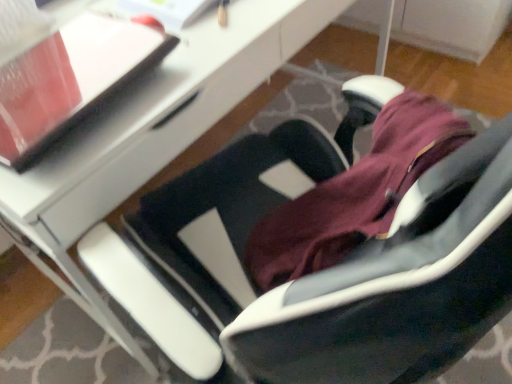
Describe the element at coordinates (71, 79) in the screenshot. I see `matte black notepad at upper left` at that location.

Where is `matte black notepad at upper left`? The width and height of the screenshot is (512, 384). matte black notepad at upper left is located at coordinates (71, 79).

You are a GUI agent. You are given a task and a screenshot of the screen. Output one action in this format:
    pyautogui.click(x=<x>, y=<y>)
    Task: Click on the white glossy desk at center
    This screenshot has height=384, width=512.
    Given the screenshot: What is the action you would take?
    pyautogui.click(x=160, y=118)

What is the approximate height of white glossy desk at center?

white glossy desk at center is 31.30 inches in height.

Measure the distance between point (205,107) and camera.

Point (205,107) is 34.25 inches from camera.

What do you see at coordinates (160, 118) in the screenshot? The width and height of the screenshot is (512, 384). I see `white glossy desk at center` at bounding box center [160, 118].

Locate an element on the screen. matte black notepad at upper left is located at coordinates (71, 79).

Which object is positioned more to the right, matte black notepad at upper left or white glossy desk at center?

white glossy desk at center.

Is matte black notepad at upper left closer to camera compared to white glossy desk at center?

Yes, it is.

Is point (134, 28) less distant than point (263, 41)?

Yes.

From the image's perspective, between matte black notepad at upper left and white glossy desk at center, who is located below?

From the image's view, matte black notepad at upper left is below.

From a real-world perspective, is matte black notepad at upper left under white glossy desk at center?

No.

Does matte black notepad at upper left have a lesser width compared to white glossy desk at center?

Yes.

Can you confirm if matte black notepad at upper left is shorter than white glossy desk at center?

Yes, matte black notepad at upper left is shorter than white glossy desk at center.

Based on their sizes in the image, would you say matte black notepad at upper left is bigger or smaller than white glossy desk at center?

In the image, matte black notepad at upper left appears to be smaller than white glossy desk at center.

Consider the image. Which is correct: matte black notepad at upper left is inside white glossy desk at center, or outside of it?

matte black notepad at upper left lies within the bounds of white glossy desk at center.

Is matte black notepad at upper left positioned far away from white glossy desk at center?

That's not correct — matte black notepad at upper left is a little close to white glossy desk at center.

Is matte black notepad at upper left aimed at white glossy desk at center?

Answer: No, matte black notepad at upper left is not turned towards white glossy desk at center.

Identify the location of desk behind the matte black notepad at upper left. Image resolution: width=512 pixels, height=384 pixels. (160, 118).

Between white glossy desk at center and matte black notepad at upper left, which one appears on the right side from the viewer's perspective?

Positioned to the right is white glossy desk at center.

Is the depth of white glossy desk at center less than that of matte black notepad at upper left?

No, it is not.

Considering the points (163, 108) and (21, 144), which point is behind, point (163, 108) or point (21, 144)?

Point (163, 108)

From the image's perspective, is white glossy desk at center under matte black notepad at upper left?

No.

From a real-world perspective, is white glossy desk at center physically below matte black notepad at upper left?

Yes, from a real-world perspective, white glossy desk at center is under matte black notepad at upper left.

Which of these two, white glossy desk at center or matte black notepad at upper left, is wider?

white glossy desk at center is wider.

Does white glossy desk at center have a greater height compared to matte black notepad at upper left?

Indeed, white glossy desk at center has a greater height compared to matte black notepad at upper left.

Considering the relative sizes of white glossy desk at center and matte black notepad at upper left in the image provided, is white glossy desk at center smaller than matte black notepad at upper left?

No, white glossy desk at center is not smaller than matte black notepad at upper left.

Could matte black notepad at upper left be considered to be inside white glossy desk at center?

No, matte black notepad at upper left is located outside of white glossy desk at center.

Consider the image. Are white glossy desk at center and matte black notepad at upper left located far from each other?

white glossy desk at center is actually quite close to matte black notepad at upper left.

Is white glossy desk at center oriented away from matte black notepad at upper left?

white glossy desk at center does not have its back to matte black notepad at upper left.

Can you tell me how much white glossy desk at center and matte black notepad at upper left differ in facing direction?

There is a 4.92-degree angle between the facing directions of white glossy desk at center and matte black notepad at upper left.

Locate an element on the screen. This screenshot has width=512, height=384. notepad that is below the white glossy desk at center (from the image's perspective) is located at coordinates (71, 79).

At what (x,y) coordinates should I click in order to perform the action: click on notepad that appears in front of the white glossy desk at center. Please return your answer as a coordinate pair (x, y). Looking at the image, I should click on (71, 79).

The height and width of the screenshot is (384, 512). I want to click on notepad below the white glossy desk at center (from the image's perspective), so click(71, 79).